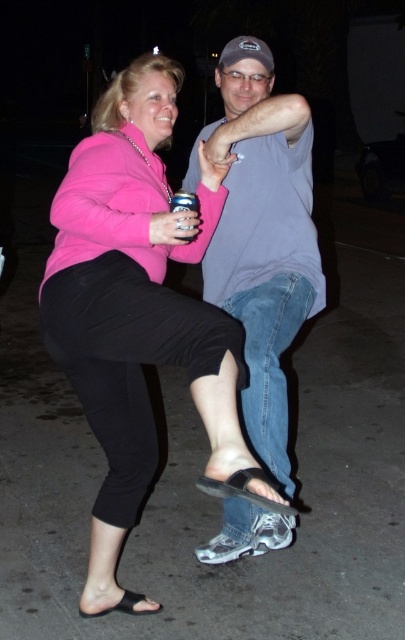
Question: Does pink matte jacket at upper left have a smaller size compared to gray cotton t-shirt at upper center?

Choices:
 (A) no
 (B) yes

Answer: (A)

Question: Observing the image, what is the correct spatial positioning of pink matte jacket at upper left in reference to gray cotton t-shirt at upper center?

Choices:
 (A) left
 (B) right

Answer: (A)

Question: Does pink matte jacket at upper left have a greater width compared to gray cotton t-shirt at upper center?

Choices:
 (A) yes
 (B) no

Answer: (A)